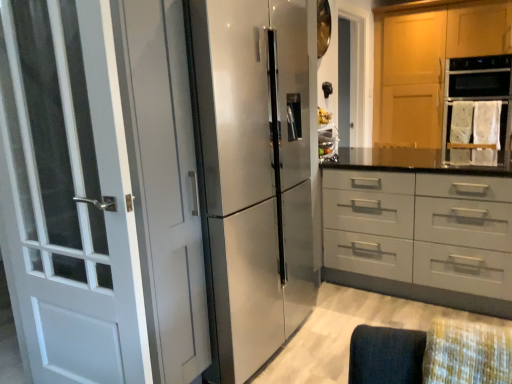
Question: Looking at their shapes, would you say wooden cabinet at upper right is wider or thinner than matte gray drawer at center?

Choices:
 (A) wide
 (B) thin

Answer: (B)

Question: From their relative heights in the image, would you say wooden cabinet at upper right is taller or shorter than matte gray drawer at center?

Choices:
 (A) tall
 (B) short

Answer: (A)

Question: Which object is positioned farthest from the satin silver refrigerator at center?

Choices:
 (A) white glossy door at left
 (B) wooden cabinet at upper right
 (C) matte gray drawer at center

Answer: (B)

Question: Which of these objects is positioned farthest from the wooden cabinet at upper right?

Choices:
 (A) satin silver refrigerator at center
 (B) matte gray drawer at center
 (C) white glossy door at left

Answer: (C)